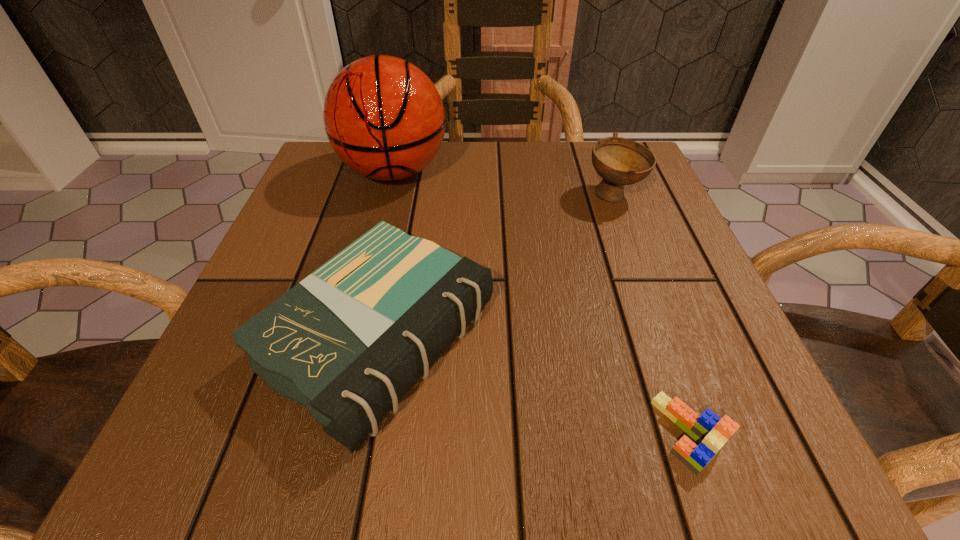
Identify the location of unoccupied area between the soup bowl and the shortest object. The height and width of the screenshot is (540, 960). (651, 314).

You are a GUI agent. You are given a task and a screenshot of the screen. Output one action in this format:
    pyautogui.click(x=<x>, y=<y>)
    Task: Click on the unoccupied position between the Lego and the third tallest object
    The width and height of the screenshot is (960, 540).
    Given the screenshot: What is the action you would take?
    pyautogui.click(x=534, y=386)

Identify the location of free space between the tallest object and the Lego. Image resolution: width=960 pixels, height=540 pixels. (541, 302).

Locate an element on the screen. This screenshot has width=960, height=540. free spot between the paperback book and the soup bowl is located at coordinates (496, 267).

Identify which object is the third closest to the third tallest object. Please provide its 2D coordinates. Your answer should be formatted as a tuple, i.e. [(x, y)], where the tuple contains the x and y coordinates of a point satisfying the conditions above.

[(619, 161)]

This screenshot has height=540, width=960. I want to click on object that is the closest to the Lego, so click(348, 342).

Where is `vacant position in the image that satisfies the following two spatial constraints: 1. on the side with spill of the tallest object; 2. on the right side of the Lego`? vacant position in the image that satisfies the following two spatial constraints: 1. on the side with spill of the tallest object; 2. on the right side of the Lego is located at coordinates (327, 433).

Where is `free space that satisfies the following two spatial constraints: 1. on the side with spill of the basketball; 2. on the left side of the shortest object`? Image resolution: width=960 pixels, height=540 pixels. free space that satisfies the following two spatial constraints: 1. on the side with spill of the basketball; 2. on the left side of the shortest object is located at coordinates (327, 433).

I want to click on free location that satisfies the following two spatial constraints: 1. on the back side of the soup bowl; 2. on the left side of the third tallest object, so click(408, 195).

This screenshot has width=960, height=540. I want to click on free location that satisfies the following two spatial constraints: 1. on the front side of the paperback book; 2. on the right side of the Lego, so click(x=360, y=433).